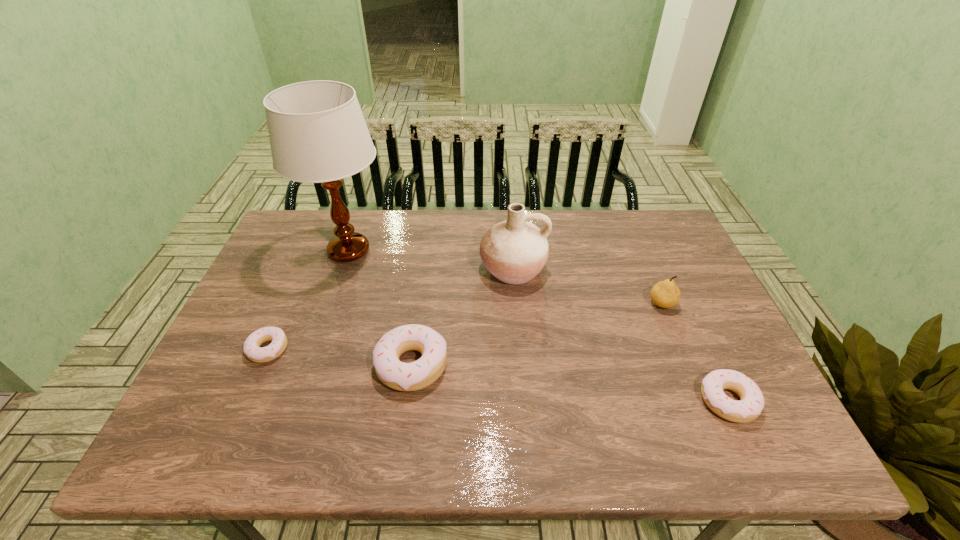
In order to click on free space between the second doughnut from right to left and the leftmost doughnut in this screenshot , I will do `click(340, 357)`.

Identify which object is located as the third nearest to the rightmost doughnut. Please provide its 2D coordinates. Your answer should be formatted as a tuple, i.e. [(x, y)], where the tuple contains the x and y coordinates of a point satisfying the conditions above.

[(421, 373)]

At what (x,y) coordinates should I click in order to perform the action: click on the fifth closest object to the pear. Please return your answer as a coordinate pair (x, y). The width and height of the screenshot is (960, 540). Looking at the image, I should click on (252, 350).

Locate an element on the screen. The width and height of the screenshot is (960, 540). doughnut that is the closest one to the third object from right to left is located at coordinates (421, 373).

This screenshot has height=540, width=960. I want to click on doughnut that stands as the closest to the fourth tallest object, so click(252, 350).

Find the location of `vacant space that satisfies the following two spatial constraints: 1. to pour from the handle of the fourth nearest object; 2. on the right side of the third object from right to left`. vacant space that satisfies the following two spatial constraints: 1. to pour from the handle of the fourth nearest object; 2. on the right side of the third object from right to left is located at coordinates pos(516,303).

Where is `vacant position in the image that satisfies the following two spatial constraints: 1. to pour from the handle of the rightmost doughnut; 2. on the right side of the fifth shortest object`? The width and height of the screenshot is (960, 540). vacant position in the image that satisfies the following two spatial constraints: 1. to pour from the handle of the rightmost doughnut; 2. on the right side of the fifth shortest object is located at coordinates (523, 401).

This screenshot has height=540, width=960. I want to click on free spot that satisfies the following two spatial constraints: 1. on the back side of the tallest object; 2. on the right side of the leftmost doughnut, so click(311, 251).

Locate an element on the screen. vacant position in the image that satisfies the following two spatial constraints: 1. to pour from the handle of the second tallest doughnut; 2. on the right side of the fifth shortest object is located at coordinates (523, 401).